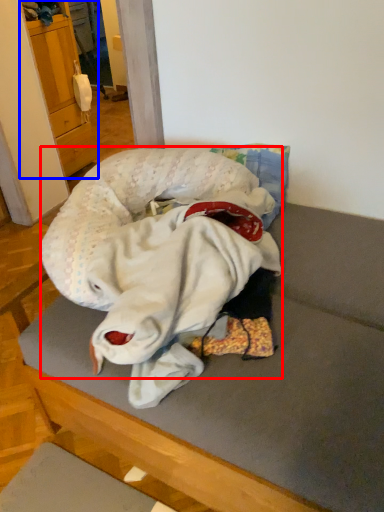
Question: Which point is further to the camera, baby (highlighted by a red box) or cabinetry (highlighted by a blue box)?

Choices:
 (A) baby
 (B) cabinetry

Answer: (B)